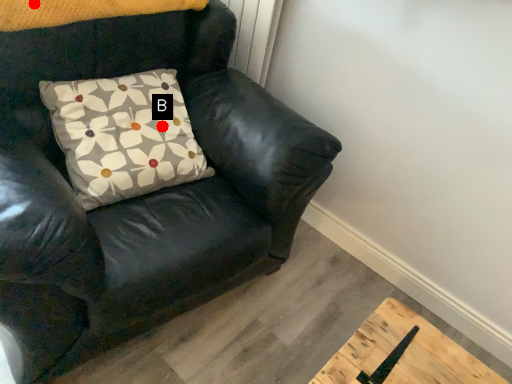
Question: Two points are circled on the image, labeled by A and B beside each circle. Among these points, which one is nearest to the camera?

Choices:
 (A) A is closer
 (B) B is closer

Answer: (A)